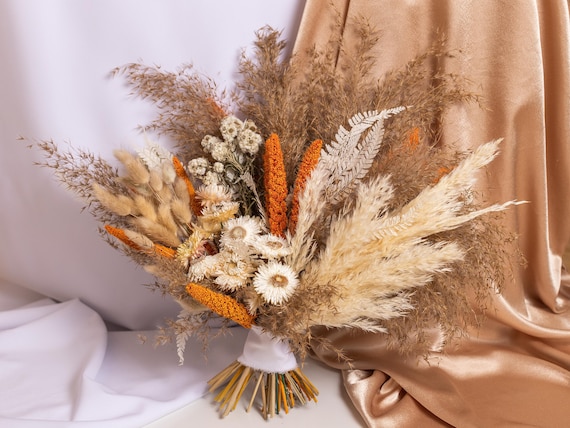
Find the location of `table top not covered in fabric`. table top not covered in fabric is located at coordinates (239, 419).